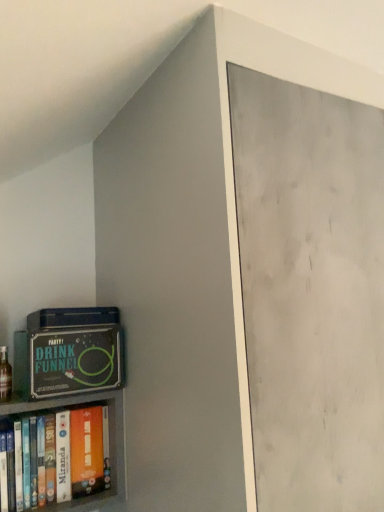
Question: In the image, is green matte board game at lower left on the left side or the right side of orange matte book at lower left?

Choices:
 (A) left
 (B) right

Answer: (A)

Question: Is green matte board game at lower left in front of or behind orange matte book at lower left in the image?

Choices:
 (A) front
 (B) behind

Answer: (A)

Question: Which is nearer to the orange matte book at lower left?

Choices:
 (A) green matte board game at lower left
 (B) translucent glass bottle at lower left

Answer: (A)

Question: Which object is the farthest from the translucent glass bottle at lower left?

Choices:
 (A) orange matte book at lower left
 (B) green matte board game at lower left

Answer: (B)